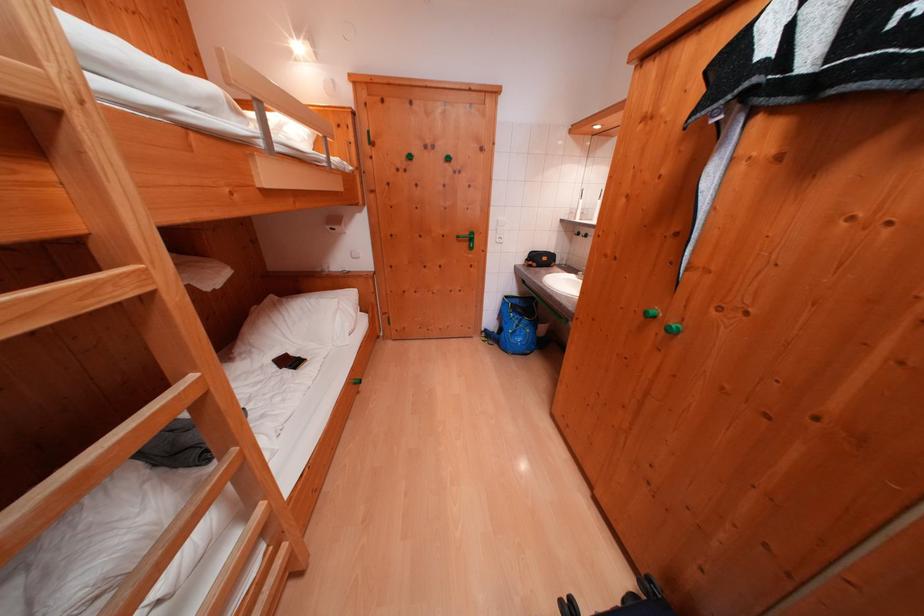
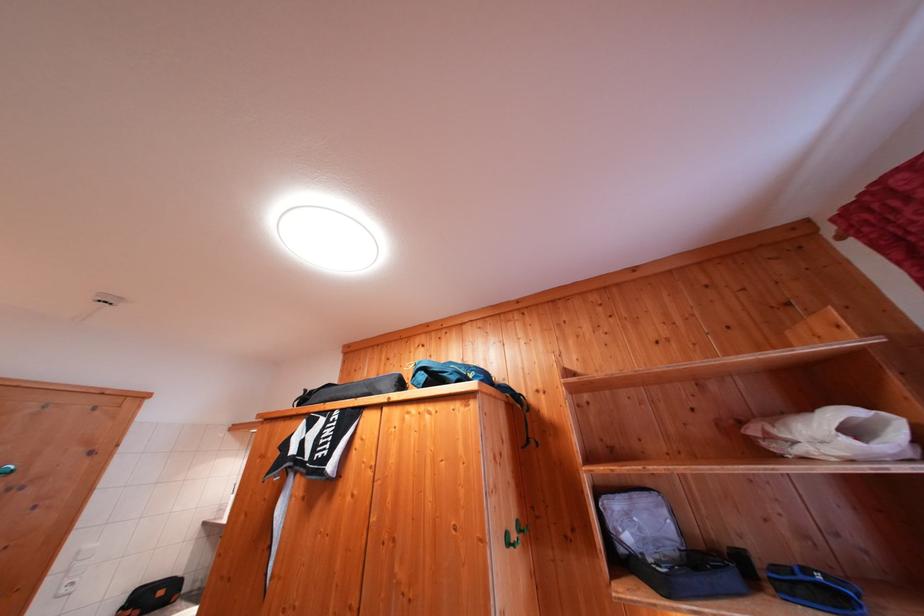
Based on the continuous images, in which direction is the camera rotating?

The rotation direction of the camera is right-up.